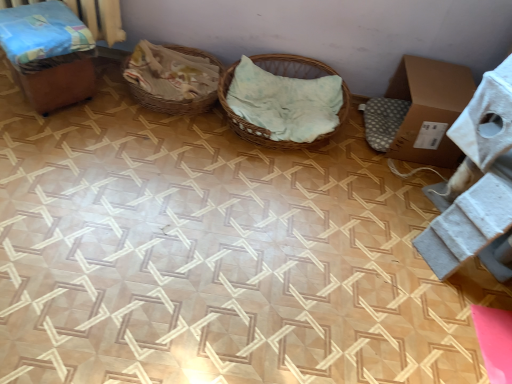
Where is `vacant area that is in front of woven wood basket at center, positioned as the 1th basket in right-to-left order`? vacant area that is in front of woven wood basket at center, positioned as the 1th basket in right-to-left order is located at coordinates (226, 180).